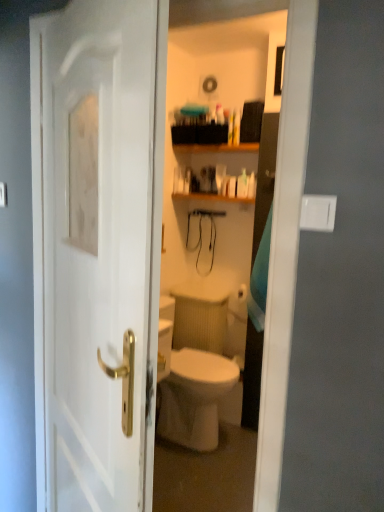
Question: Is white glossy door at center spatially inside wooden shelf at upper center, or outside of it?

Choices:
 (A) outside
 (B) inside

Answer: (A)

Question: From the image's perspective, is white glossy door at center positioned above or below wooden shelf at upper center?

Choices:
 (A) below
 (B) above

Answer: (A)

Question: Estimate the real-world distances between objects in this image. Which object is closer to the white glossy bottle at upper center?

Choices:
 (A) wooden shelf at upper center
 (B) white glossy door at center

Answer: (A)

Question: Estimate the real-world distances between objects in this image. Which object is farther from the wooden shelf at upper center?

Choices:
 (A) white glossy door at center
 (B) white glossy bottle at upper center

Answer: (A)